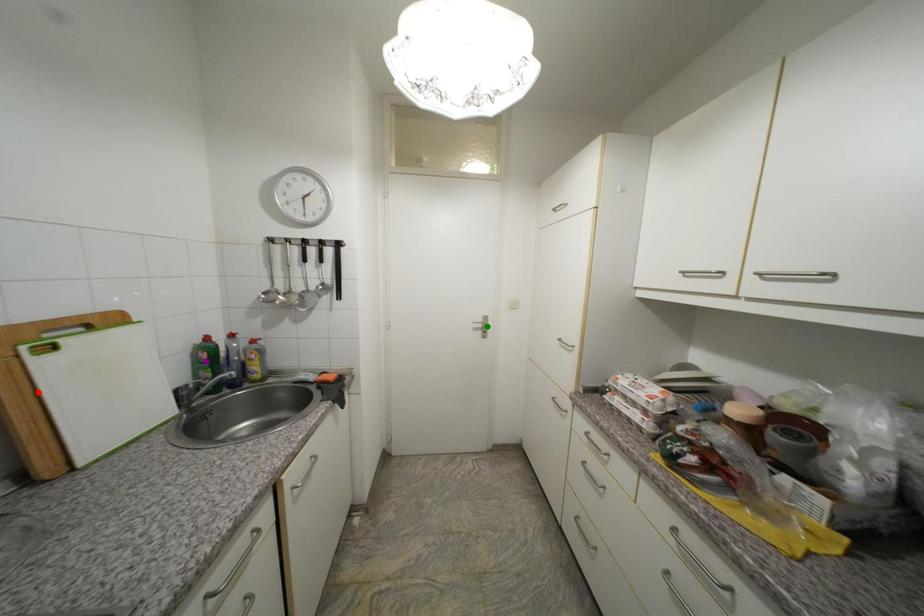
Order these from nearest to farthest:
1. green point
2. purple point
3. red point

→ 1. red point
2. purple point
3. green point